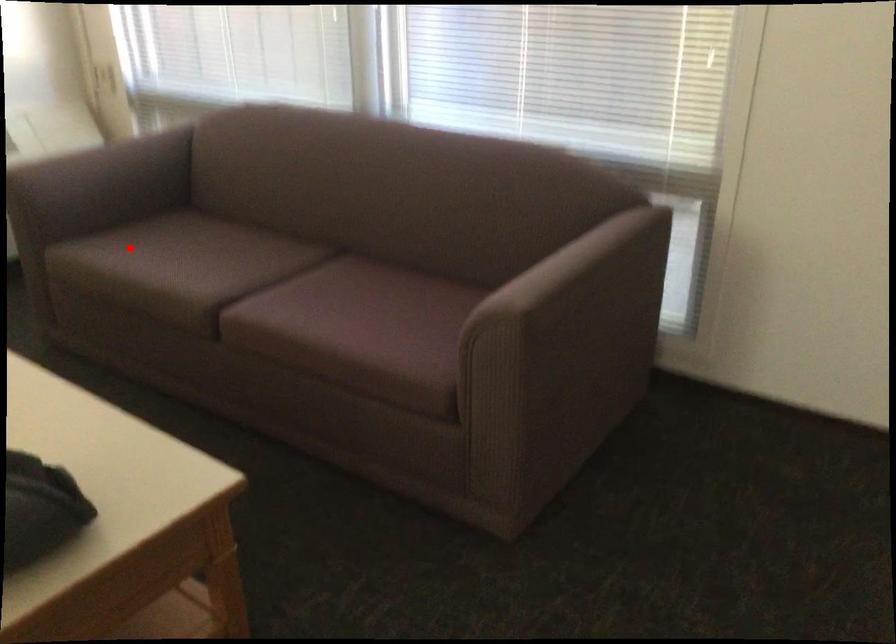
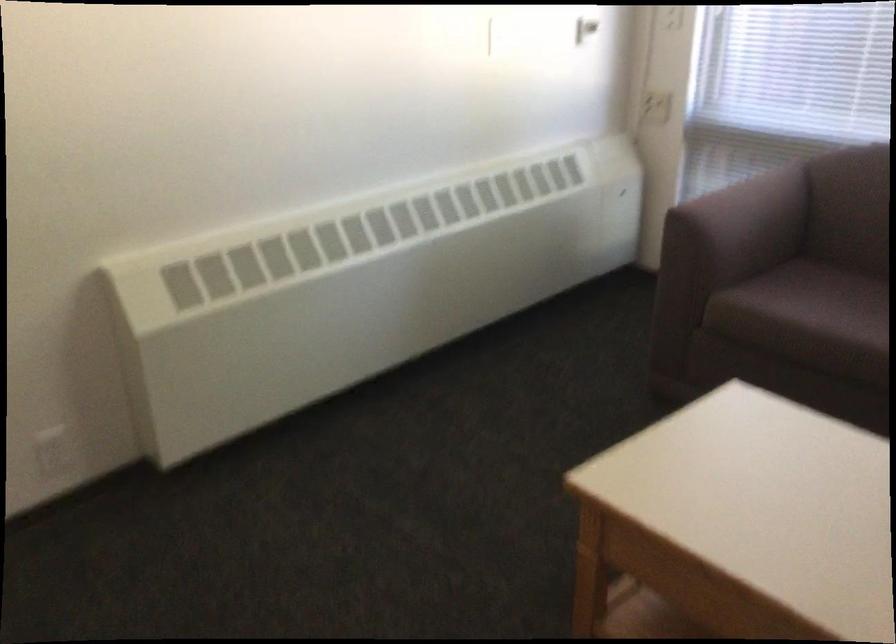
Question: I am providing you with two images of the same scene from different viewpoints. A red point is marked on the first image. Can you still see the location of the red point in image 2?

Choices:
 (A) Yes
 (B) No

Answer: (A)